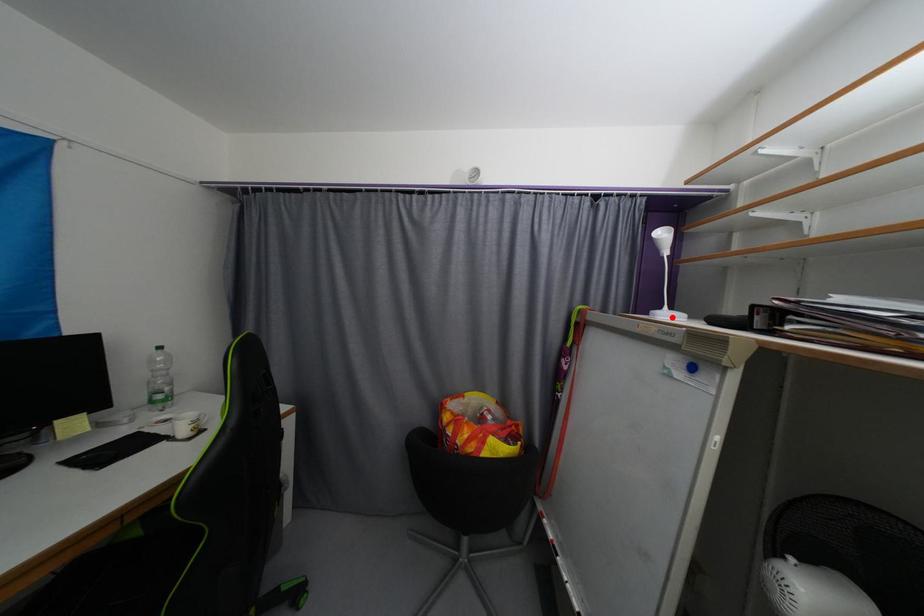
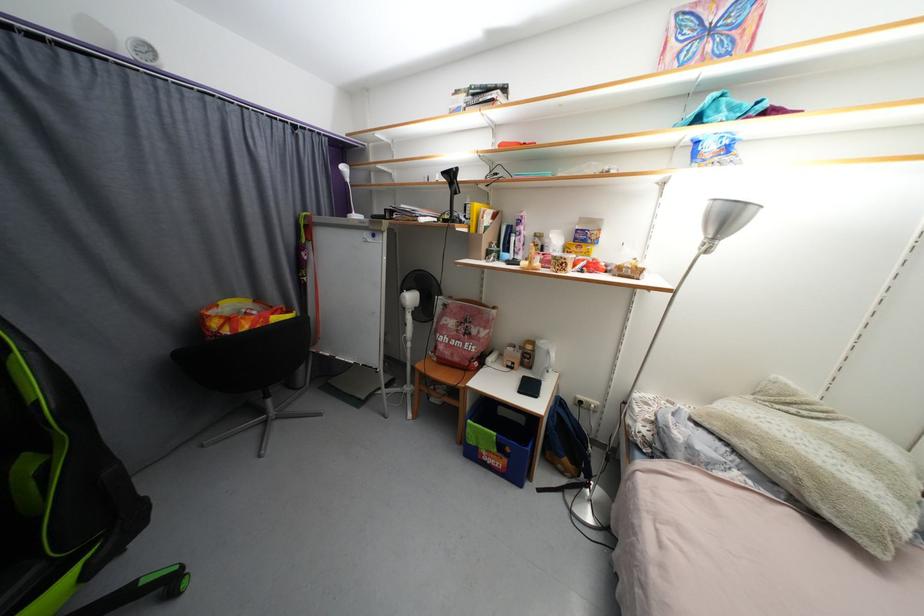
Where in the second image is the point corresponding to the highlighted location from the first image?

(360, 217)